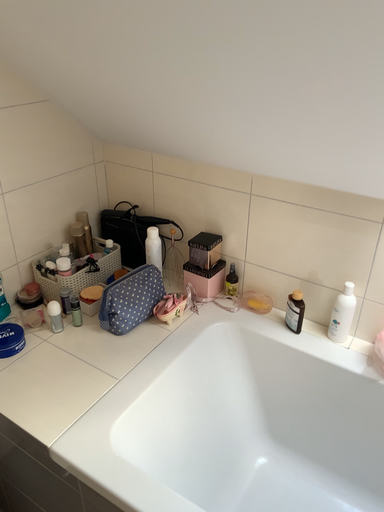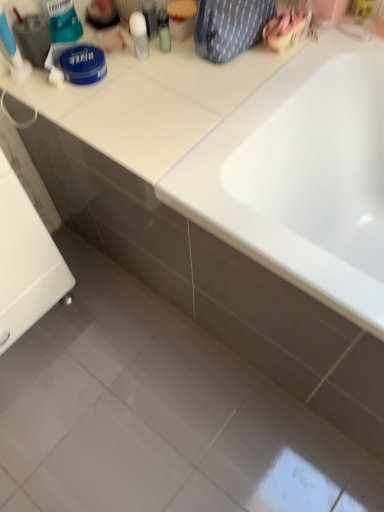
Question: How did the camera likely rotate when shooting the video?

Choices:
 (A) rotated upward
 (B) rotated downward

Answer: (B)